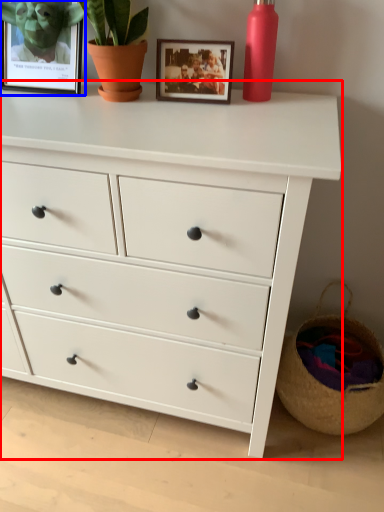
Question: Which of the following is the closest to the observer, chest of drawers (highlighted by a red box) or picture frame (highlighted by a blue box)?

Choices:
 (A) chest of drawers
 (B) picture frame

Answer: (A)